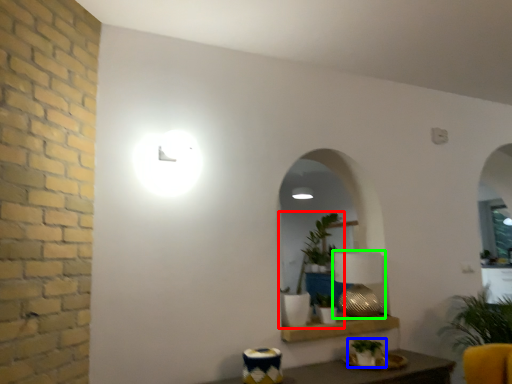
Question: Which is farther away from houseplant (highlighted by a red box)? houseplant (highlighted by a blue box) or table lamp (highlighted by a green box)?

Choices:
 (A) houseplant
 (B) table lamp

Answer: (A)